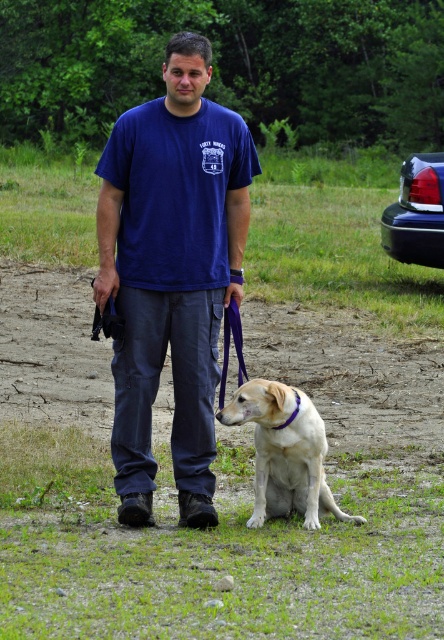
Between light brown fur at center and glossy plastic car at upper right, which one is positioned lower?

light brown fur at center

Does light brown fur at center appear on the left side of glossy plastic car at upper right?

Correct, you'll find light brown fur at center to the left of glossy plastic car at upper right.

Looking at this image, who is more forward, (292, 470) or (424, 182)?

Point (292, 470) is more forward.

Locate an element on the screen. light brown fur at center is located at coordinates (285, 452).

Describe the element at coordinates (171, 273) in the screenshot. I see `blue cotton t-shirt at center` at that location.

Can you confirm if blue cotton t-shirt at center is smaller than light brown fur at center?

No, blue cotton t-shirt at center is not smaller than light brown fur at center.

Who is more forward, (134, 515) or (317, 440)?

Positioned in front is point (134, 515).

Locate an element on the screen. This screenshot has height=640, width=444. blue cotton t-shirt at center is located at coordinates (171, 273).

Does blue cotton t-shirt at center lie behind glossy plastic car at upper right?

No.

Does blue cotton t-shirt at center have a larger size compared to glossy plastic car at upper right?

No.

Between point (115, 339) and point (427, 193), which one is positioned in front?

Positioned in front is point (115, 339).

Locate an element on the screen. The width and height of the screenshot is (444, 640). blue cotton t-shirt at center is located at coordinates (171, 273).